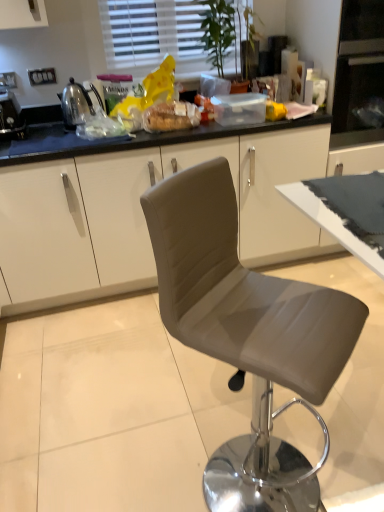
Question: Considering the relative positions of shiny metallic kettle at left, marked as the 1th appliance in a right-to-left arrangement, and metallic silver toaster at left, the 2th appliance positioned from the right, in the image provided, is shiny metallic kettle at left, marked as the 1th appliance in a right-to-left arrangement, to the left of metallic silver toaster at left, the 2th appliance positioned from the right, from the viewer's perspective?

Choices:
 (A) no
 (B) yes

Answer: (A)

Question: Considering the relative sizes of shiny metallic kettle at left, which is counted as the second appliance, starting from the left, and metallic silver toaster at left, the 2th appliance positioned from the right, in the image provided, is shiny metallic kettle at left, which is counted as the second appliance, starting from the left, taller than metallic silver toaster at left, the 2th appliance positioned from the right,?

Choices:
 (A) no
 (B) yes

Answer: (B)

Question: Is the depth of shiny metallic kettle at left, marked as the 1th appliance in a right-to-left arrangement, greater than that of metallic silver toaster at left, which is the 1th appliance in left-to-right order?

Choices:
 (A) yes
 (B) no

Answer: (A)

Question: Is there a large distance between shiny metallic kettle at left, marked as the 1th appliance in a right-to-left arrangement, and metallic silver toaster at left, the 2th appliance positioned from the right?

Choices:
 (A) yes
 (B) no

Answer: (B)

Question: Does shiny metallic kettle at left, marked as the 1th appliance in a right-to-left arrangement, contain metallic silver toaster at left, which is the 1th appliance in left-to-right order?

Choices:
 (A) no
 (B) yes

Answer: (A)

Question: Does shiny metallic kettle at left, which is counted as the second appliance, starting from the left, have a larger size compared to metallic silver toaster at left, which is the 1th appliance in left-to-right order?

Choices:
 (A) no
 (B) yes

Answer: (B)

Question: Can you confirm if metallic silver toaster at left, which is the 1th appliance in left-to-right order, is taller than shiny metallic kettle at left, which is counted as the second appliance, starting from the left?

Choices:
 (A) yes
 (B) no

Answer: (B)

Question: Can you confirm if metallic silver toaster at left, the 2th appliance positioned from the right, is shorter than shiny metallic kettle at left, which is counted as the second appliance, starting from the left?

Choices:
 (A) yes
 (B) no

Answer: (A)

Question: Is metallic silver toaster at left, the 2th appliance positioned from the right, positioned behind shiny metallic kettle at left, marked as the 1th appliance in a right-to-left arrangement?

Choices:
 (A) yes
 (B) no

Answer: (B)

Question: Can you confirm if metallic silver toaster at left, the 2th appliance positioned from the right, is positioned to the left of shiny metallic kettle at left, marked as the 1th appliance in a right-to-left arrangement?

Choices:
 (A) no
 (B) yes

Answer: (B)

Question: Considering the relative sizes of metallic silver toaster at left, which is the 1th appliance in left-to-right order, and shiny metallic kettle at left, which is counted as the second appliance, starting from the left, in the image provided, is metallic silver toaster at left, which is the 1th appliance in left-to-right order, bigger than shiny metallic kettle at left, which is counted as the second appliance, starting from the left,?

Choices:
 (A) yes
 (B) no

Answer: (B)

Question: Is metallic silver toaster at left, which is the 1th appliance in left-to-right order, not inside shiny metallic kettle at left, which is counted as the second appliance, starting from the left?

Choices:
 (A) yes
 (B) no

Answer: (A)

Question: Is translucent plastic bread at center to the left of satin grey chair at center from the viewer's perspective?

Choices:
 (A) no
 (B) yes

Answer: (B)